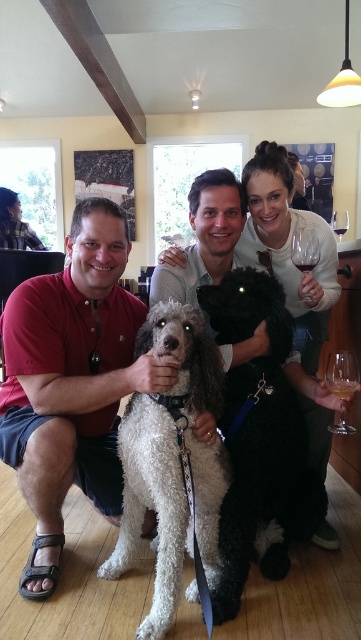
Based on the photo, you are standing in the room and want to find the shiny black dog at center. According to the scene description, where should you look relative to the man holding the white poodle?

The shiny black dog at center is located at point [288,248], so you should look towards the center of the room where the coordinates indicate the position relative to the man holding the white poodle.

You are a guest at this gathering and want to grab a drink from the table. The table has two glasses, the dark red glass at upper center and the transparent glass at upper right. Which glass is easier to reach without moving your position?

The dark red glass at upper center is easier to reach because it is closer to the viewer than the transparent glass at upper right.

You are at a party and want to grab a drink. There are two transparent glass wine at upper right and transparent glass wine glass at upper right. Which one is on the left side?

The transparent glass wine at upper right is positioned on the left side of the transparent glass wine glass at upper right.